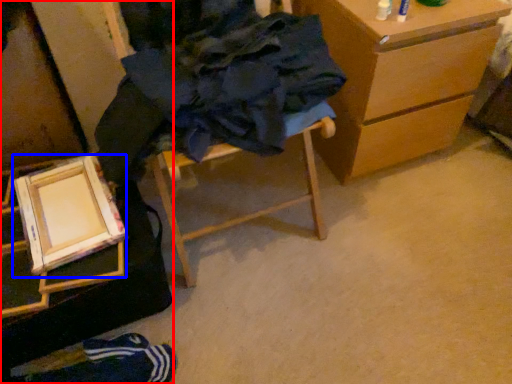
Question: Which point is further to the camera, furniture (highlighted by a red box) or picture frame (highlighted by a blue box)?

Choices:
 (A) furniture
 (B) picture frame

Answer: (B)